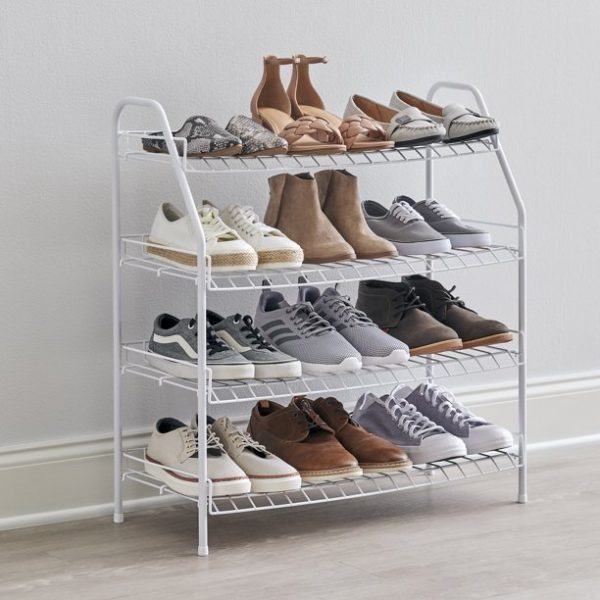
You are a GUI agent. You are given a task and a screenshot of the screen. Output one action in this format:
    pyautogui.click(x=<x>, y=<y>)
    Task: Click on the shoes on fourth shelf
    This screenshot has height=600, width=600.
    Given the screenshot: What is the action you would take?
    (459, 423), (417, 431), (363, 443), (313, 462), (263, 475), (226, 481)